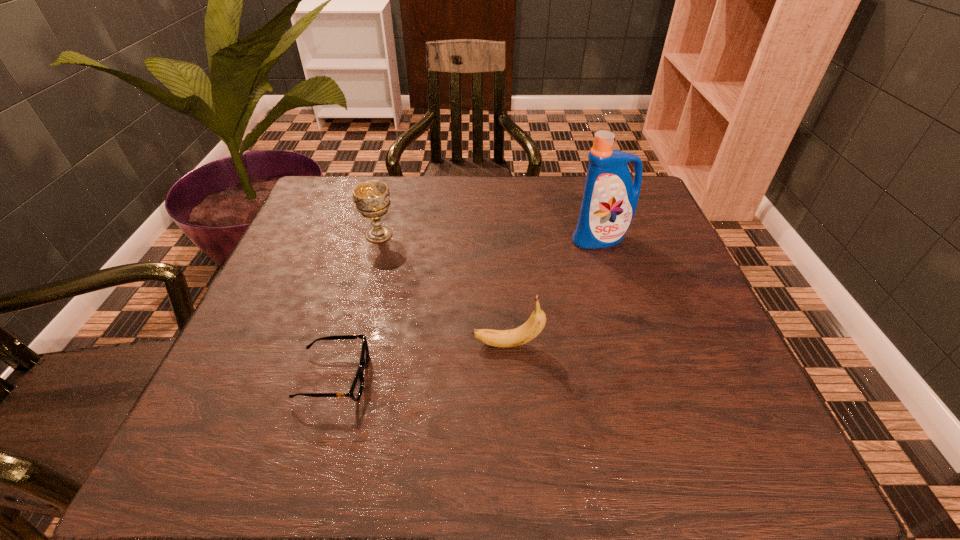
Image resolution: width=960 pixels, height=540 pixels. Find the location of `free space located on the front-facing side of the sunglasses`. free space located on the front-facing side of the sunglasses is located at coordinates (532, 377).

Where is `object located in the far edge section of the desktop`? The height and width of the screenshot is (540, 960). object located in the far edge section of the desktop is located at coordinates (371, 198).

Where is `object at the left edge`? object at the left edge is located at coordinates (357, 386).

Locate an element on the screen. The width and height of the screenshot is (960, 540). object located in the right edge section of the desktop is located at coordinates point(610,199).

In the image, there is a desktop. Where is `vacant space at the far edge`? vacant space at the far edge is located at coordinates (530, 186).

This screenshot has height=540, width=960. Identify the location of vacant space at the near edge. click(x=377, y=419).

Locate an element on the screen. This screenshot has height=540, width=960. free space at the left edge of the desktop is located at coordinates (349, 246).

The height and width of the screenshot is (540, 960). What are the coordinates of `vacant space at the right edge` in the screenshot? It's located at (652, 261).

The height and width of the screenshot is (540, 960). Identify the location of unoccupied area between the third object from left to right and the chalice. (444, 289).

The image size is (960, 540). Identify the location of vacant point located between the detergent and the sunglasses. (468, 308).